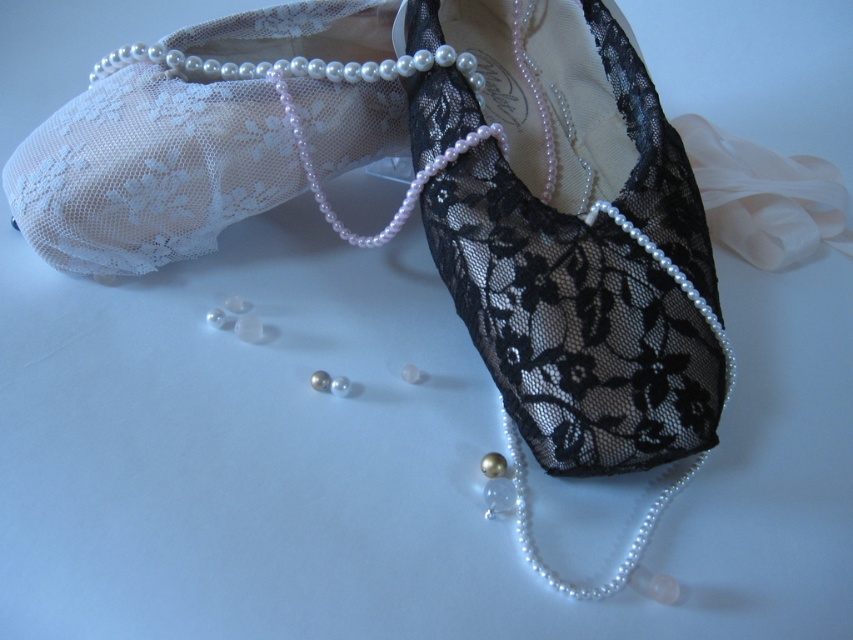
Question: Considering the relative positions of pearl/golden at center and pearl at center in the image provided, where is pearl/golden at center located with respect to pearl at center?

Choices:
 (A) above
 (B) below

Answer: (A)

Question: Which object is farther from the camera taking this photo?

Choices:
 (A) pearl at center
 (B) pearl/glass at lower center
 (C) pearl/golden at center

Answer: (A)

Question: Which of the following is the closest to the observer?

Choices:
 (A) coord(334,381)
 (B) coord(318,380)
 (C) coord(167,81)
 (D) coord(409,380)

Answer: (B)

Question: Which point appears farthest from the camera in this image?

Choices:
 (A) (415, 368)
 (B) (115, 140)
 (C) (328, 384)
 (D) (335, 380)

Answer: (A)

Question: Is pearl at center closer to the viewer compared to pearl/glass at center?

Choices:
 (A) yes
 (B) no

Answer: (A)

Question: Is black lace ballet slipper at upper center smaller than pearl/glass at lower center?

Choices:
 (A) no
 (B) yes

Answer: (A)